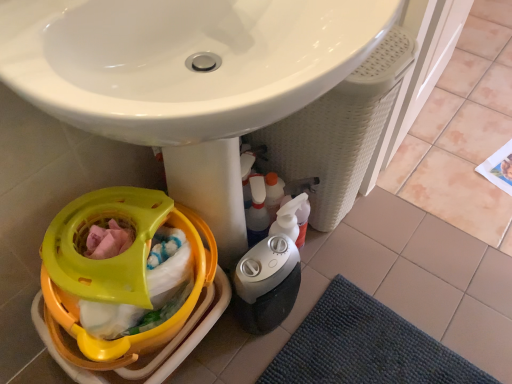
Locate an element on the screen. vacant point to the right of translucent plastic spray bottle at lower center is located at coordinates (329, 258).